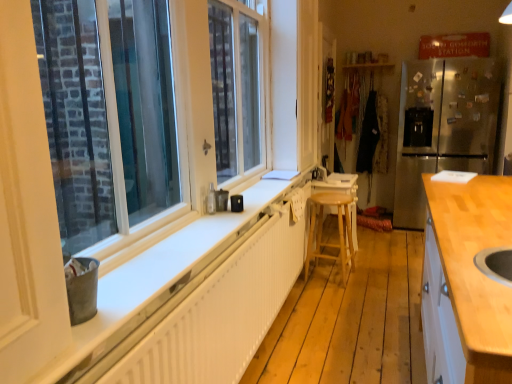
Where is `free space in front of light brown wooden stool at center`? free space in front of light brown wooden stool at center is located at coordinates (336, 297).